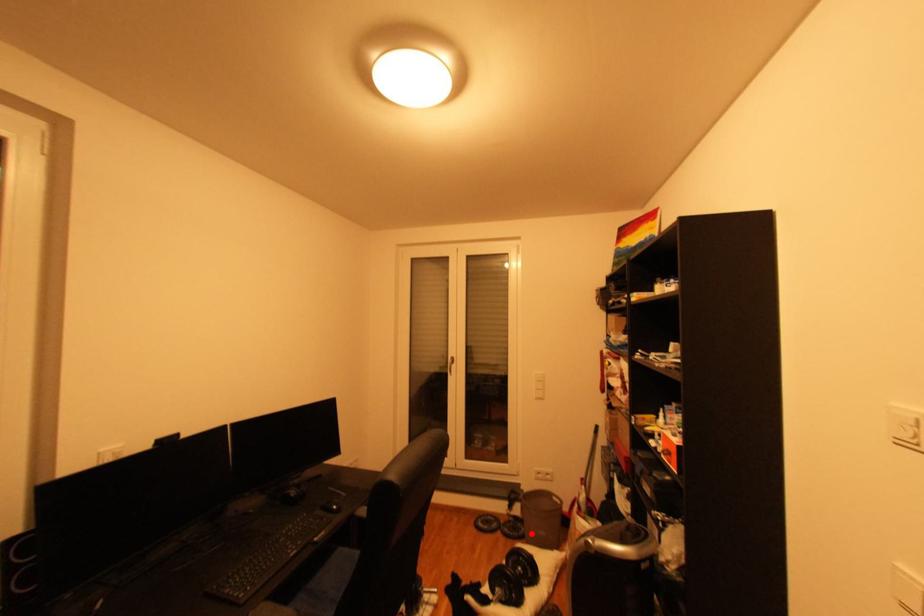
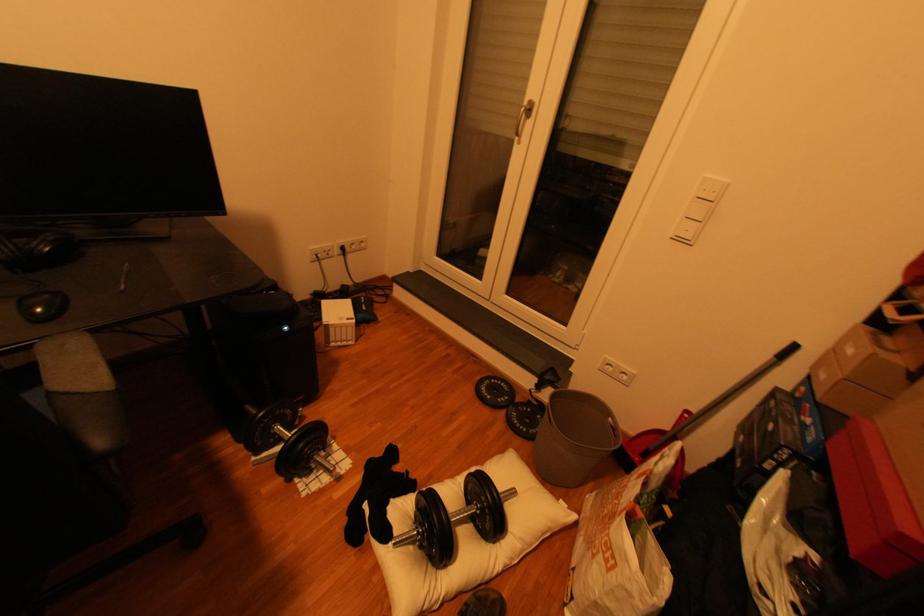
Question: I am providing you with two images of the same scene from different viewpoints. A red point is marked on the first image. At the location where the point appears in image 1, is it still visible in image 2?

Choices:
 (A) Yes
 (B) No

Answer: (A)